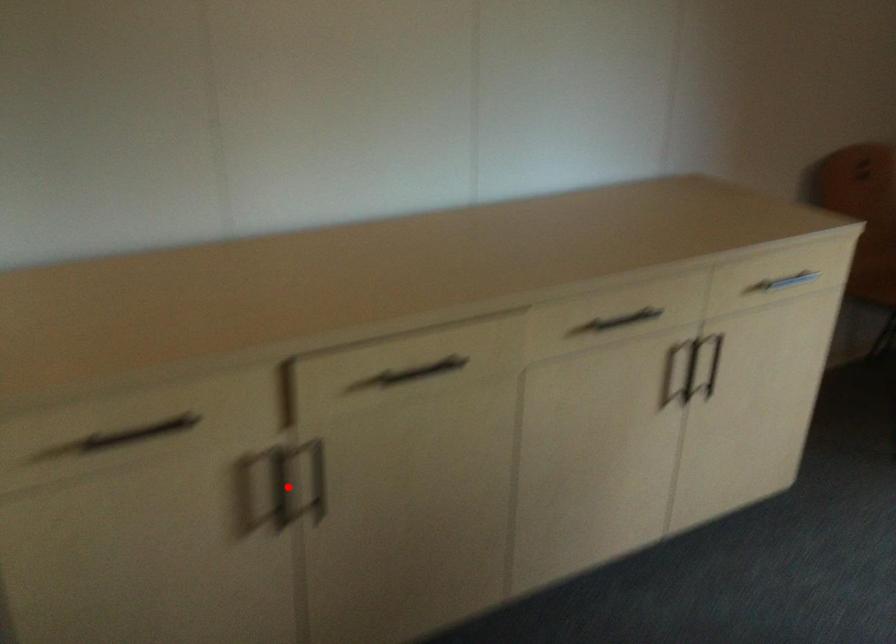
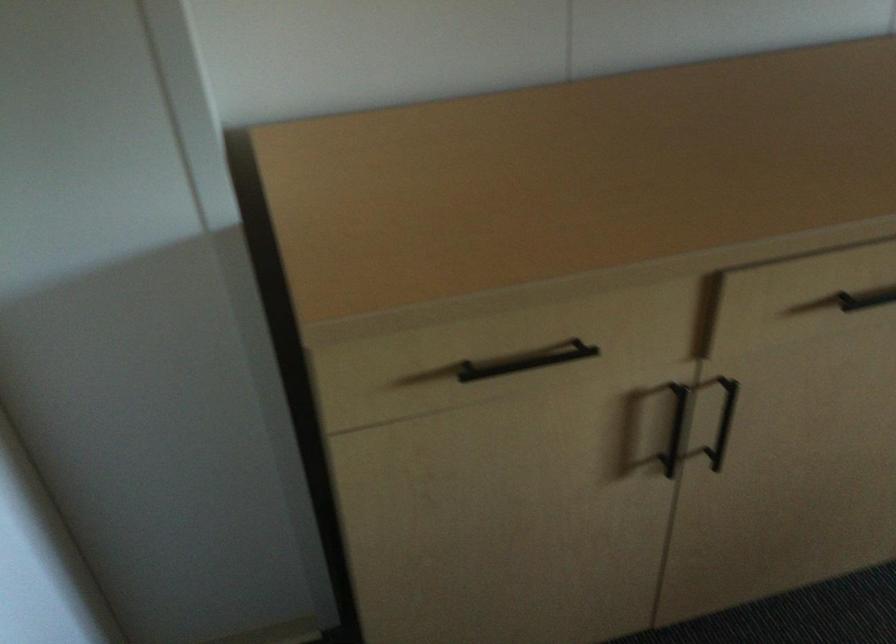
Where in the second image is the point corresponding to the highlighted location from the first image?

(675, 428)